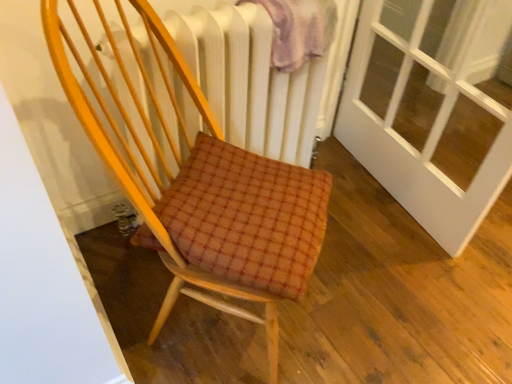
Identify the location of vacant space to the right of wooden chair at center. pos(364,299).